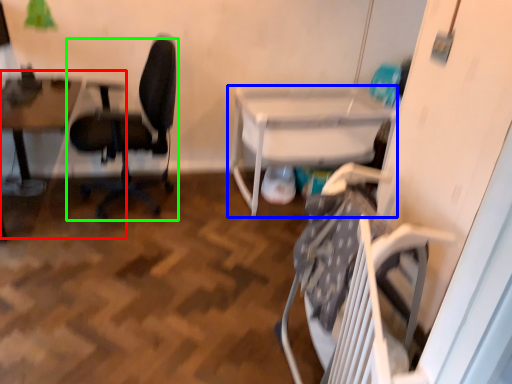
Question: Which object is positioned closest to table (highlighted by a red box)? Select from table (highlighted by a blue box) and chair (highlighted by a green box).

Choices:
 (A) table
 (B) chair

Answer: (B)